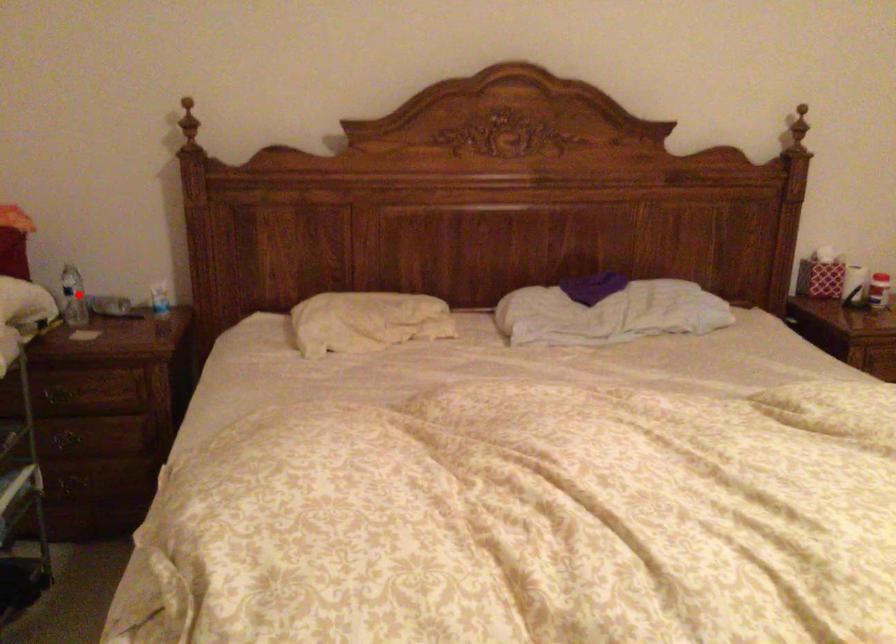
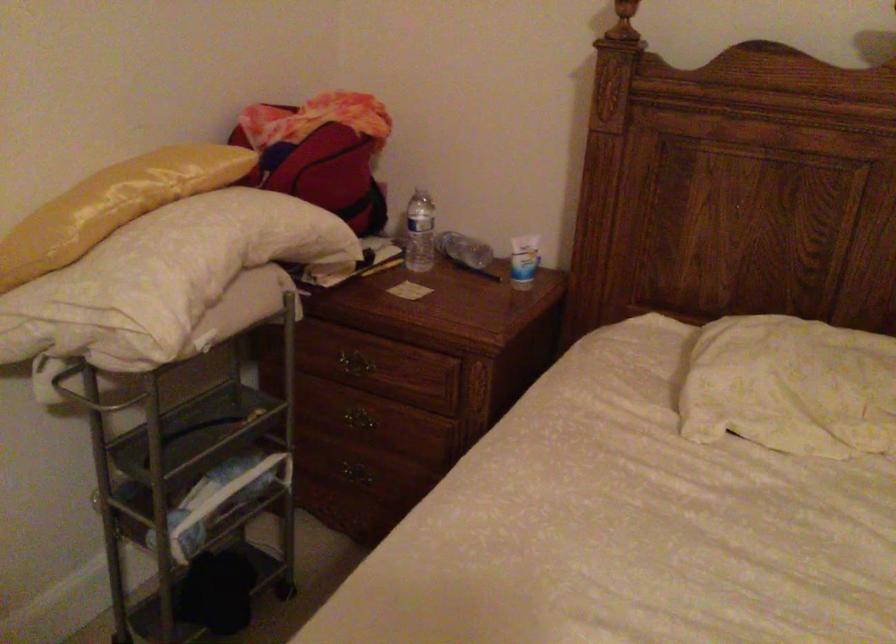
Locate, in the second image, the point that corresponds to the highlighted location in the first image.

(419, 232)